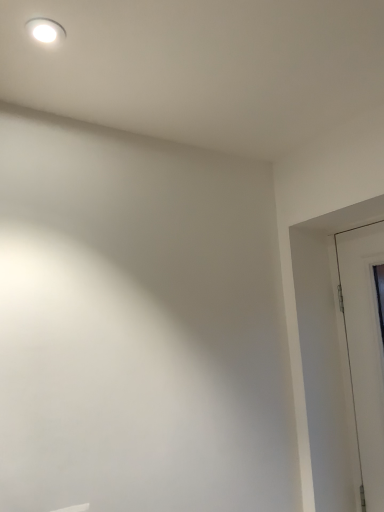
Question: Could you tell me if white glossy door at right is facing white glossy light fixture at upper left?

Choices:
 (A) yes
 (B) no

Answer: (A)

Question: From a real-world perspective, does white glossy door at right sit lower than white glossy light fixture at upper left?

Choices:
 (A) no
 (B) yes

Answer: (B)

Question: Considering the relative positions of white glossy door at right and white glossy light fixture at upper left in the image provided, is white glossy door at right to the right of white glossy light fixture at upper left from the viewer's perspective?

Choices:
 (A) no
 (B) yes

Answer: (B)

Question: Can you confirm if white glossy door at right is thinner than white glossy light fixture at upper left?

Choices:
 (A) yes
 (B) no

Answer: (A)

Question: Is white glossy door at right positioned in front of white glossy light fixture at upper left?

Choices:
 (A) no
 (B) yes

Answer: (A)

Question: From the image's perspective, is white glossy door at right below white glossy light fixture at upper left?

Choices:
 (A) no
 (B) yes

Answer: (B)

Question: From the image's perspective, is white glossy light fixture at upper left on white glossy door at right?

Choices:
 (A) yes
 (B) no

Answer: (A)

Question: Considering the relative sizes of white glossy light fixture at upper left and white glossy door at right in the image provided, is white glossy light fixture at upper left wider than white glossy door at right?

Choices:
 (A) yes
 (B) no

Answer: (A)

Question: Is white glossy door at right completely or partially inside white glossy light fixture at upper left?

Choices:
 (A) yes
 (B) no

Answer: (B)

Question: Can you confirm if white glossy light fixture at upper left is thinner than white glossy door at right?

Choices:
 (A) yes
 (B) no

Answer: (B)

Question: Is white glossy light fixture at upper left taller than white glossy door at right?

Choices:
 (A) no
 (B) yes

Answer: (A)

Question: Would you consider white glossy light fixture at upper left to be distant from white glossy door at right?

Choices:
 (A) no
 (B) yes

Answer: (B)

Question: Is white glossy light fixture at upper left in front of or behind white glossy door at right in the image?

Choices:
 (A) front
 (B) behind

Answer: (A)